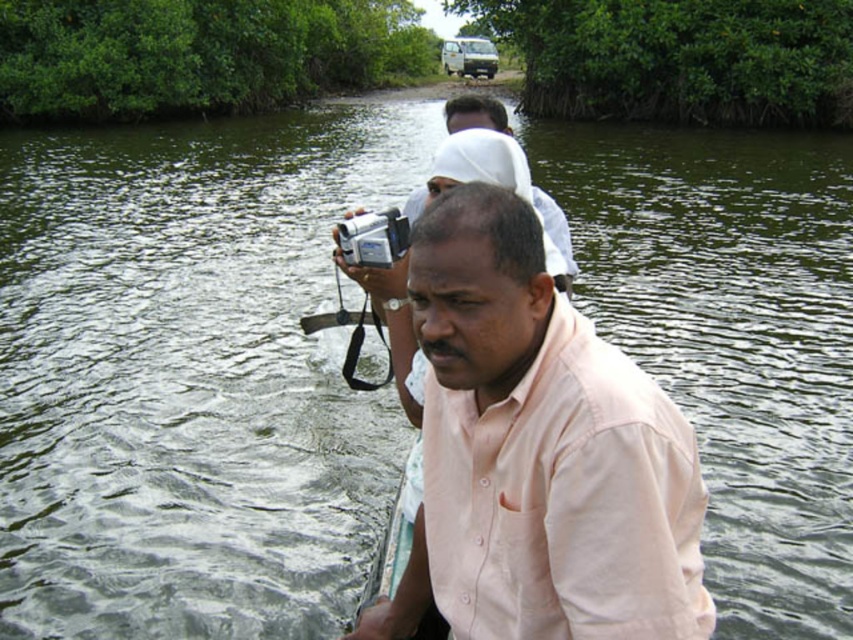
Between pink cotton shirt at center and silver plastic camera at center, which one has less height?

Standing shorter between the two is silver plastic camera at center.

Is pink cotton shirt at center thinner than silver plastic camera at center?

No, pink cotton shirt at center is not thinner than silver plastic camera at center.

Which is in front, point (558, 381) or point (376, 243)?

Point (558, 381) is in front.

I want to click on pink cotton shirt at center, so click(x=537, y=452).